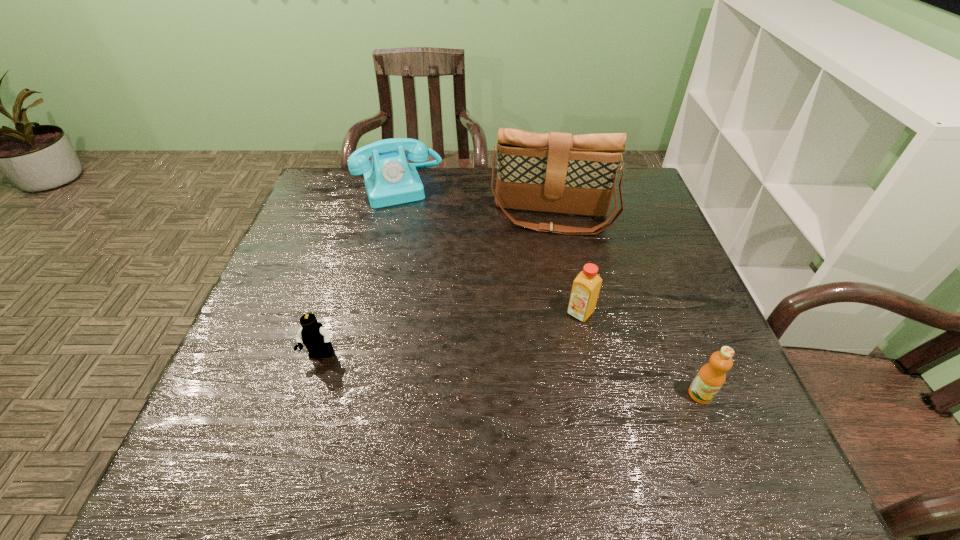
Locate an element on the screen. This screenshot has width=960, height=540. Lego is located at coordinates (316, 338).

What are the coordinates of `the shortest object` in the screenshot? It's located at (316, 338).

Where is `the nearer orange juice`? Image resolution: width=960 pixels, height=540 pixels. the nearer orange juice is located at coordinates (711, 376).

Locate an element on the screen. the right orange juice is located at coordinates (711, 376).

Where is `the third nearest object`? the third nearest object is located at coordinates (585, 290).

Where is `the left orange juice`? The image size is (960, 540). the left orange juice is located at coordinates (585, 290).

I want to click on the tallest object, so click(555, 172).

This screenshot has width=960, height=540. Identify the location of telephone. (389, 180).

The width and height of the screenshot is (960, 540). I want to click on blank space located 0.050m on the front-facing side of the second nearest object, so click(x=311, y=386).

The width and height of the screenshot is (960, 540). I want to click on free space located on the front and back of the left orange juice, so click(560, 339).